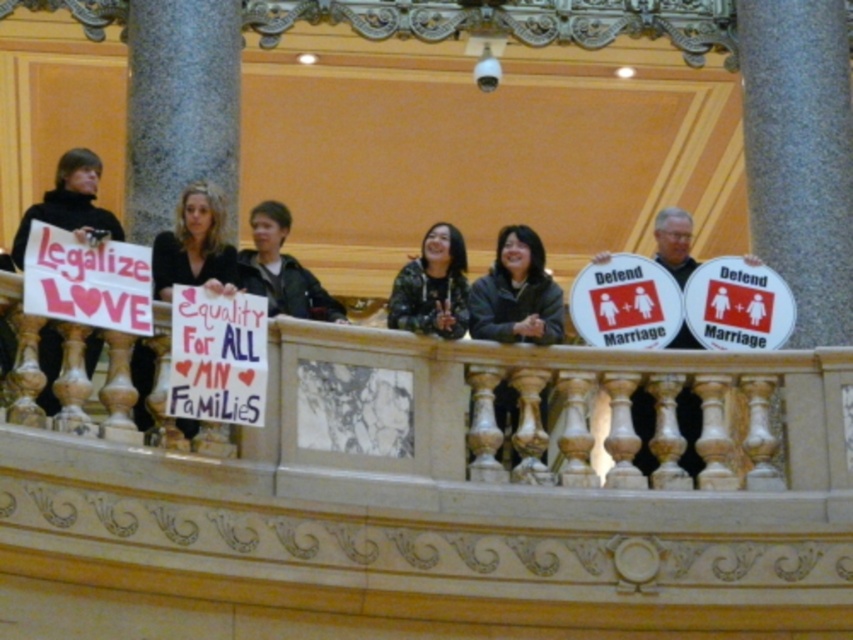
Does dark gray jacket at center have a smaller size compared to matte black shirt at center?

Actually, dark gray jacket at center might be larger than matte black shirt at center.

Who is more distant from viewer, [515,456] or [189,186]?

The point [189,186] is behind.

Find the location of a particular element. dark gray jacket at center is located at coordinates (515, 292).

Can you confirm if matte black shirt at center is bigger than camouflage jacket at center?

Incorrect, matte black shirt at center is not larger than camouflage jacket at center.

Identify the location of matte black shirt at center. This screenshot has width=853, height=640. (195, 244).

Looking at this image, how much distance is there between dark gray jacket at center and black matte sign at left?

dark gray jacket at center is 9.28 meters from black matte sign at left.

Does dark gray jacket at center have a smaller size compared to black matte sign at left?

No.

The width and height of the screenshot is (853, 640). Identify the location of dark gray jacket at center. pyautogui.click(x=515, y=292).